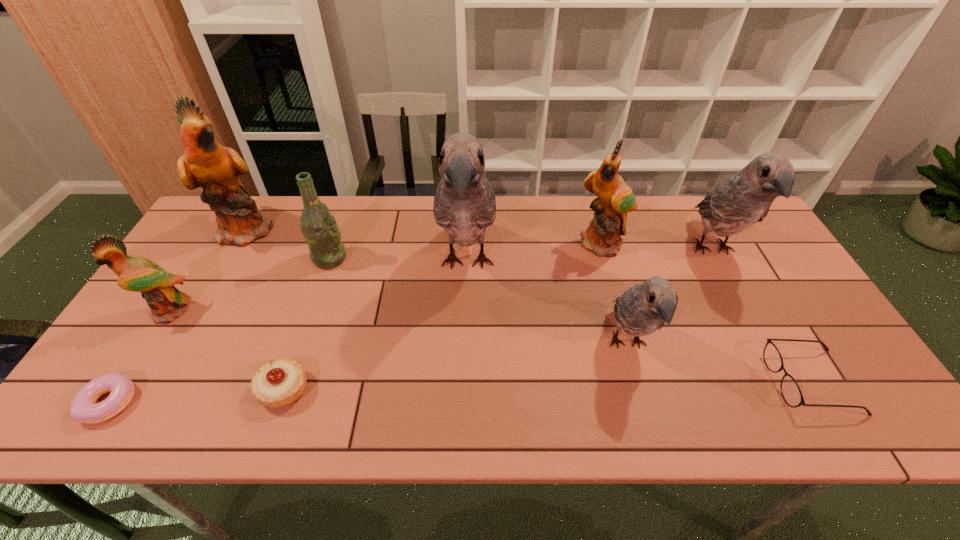
You are a GUI agent. You are given a task and a screenshot of the screen. Output one action in this format:
    pyautogui.click(x=<x>, y=<y>)
    Task: Click on the vacant space at the near right corner
    This screenshot has height=540, width=960.
    Given the screenshot: What is the action you would take?
    pyautogui.click(x=876, y=415)

At what (x,y) coordinates should I click in order to perform the action: click on free space between the beige pastry and the spectacles. Please return your answer as a coordinate pair (x, y). The height and width of the screenshot is (540, 960). Looking at the image, I should click on coord(547,386).

Locate an element on the screen. vacant region between the leftmost gray parrot and the purple doughnut is located at coordinates (288, 333).

You are a GUI agent. You are given a task and a screenshot of the screen. Output one action in this format:
    pyautogui.click(x=<x>, y=<y>)
    Task: Click on the unoccupied position between the smallest green parrot and the biggest green parrot
    Image resolution: width=960 pixels, height=540 pixels.
    Given the screenshot: What is the action you would take?
    pyautogui.click(x=209, y=271)

Locate an element on the screen. free point between the beer bottle and the second gray parrot from left to right is located at coordinates (478, 301).

Identify the location of free space between the second smallest green parrot and the smallest gray parrot. The width and height of the screenshot is (960, 540). (615, 294).

This screenshot has height=540, width=960. Find the location of `blank region between the nearest green parrot and the shortest object`. blank region between the nearest green parrot and the shortest object is located at coordinates (139, 357).

The height and width of the screenshot is (540, 960). What are the coordinates of `vacant space in between the leftmost gray parrot and the biggest green parrot` in the screenshot? It's located at point(357,247).

This screenshot has width=960, height=540. Identify the location of free space between the sixth object from left to right and the second gray parrot from right to left. (547, 304).

Identify the location of unoccupied position between the doughnut and the second biggest green parrot. This screenshot has height=540, width=960. (356, 323).